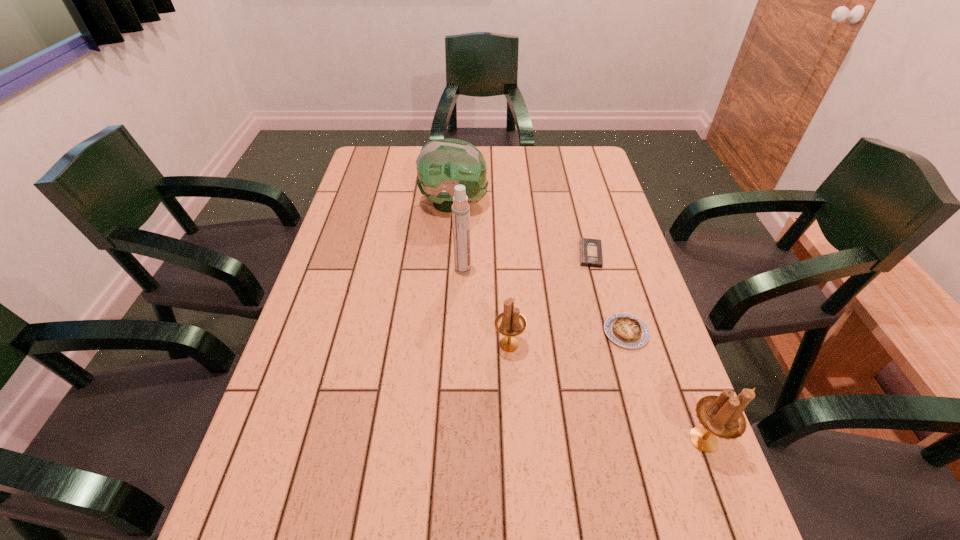
Considering the uniform spacing of candle holders, where should an additional candle holder be positioned on the left? Please locate a free spot. Please provide its 2D coordinates. Your answer should be formatted as a tuple, i.e. [(x, y)], where the tuple contains the x and y coordinates of a point satisfying the conditions above.

[(368, 275)]